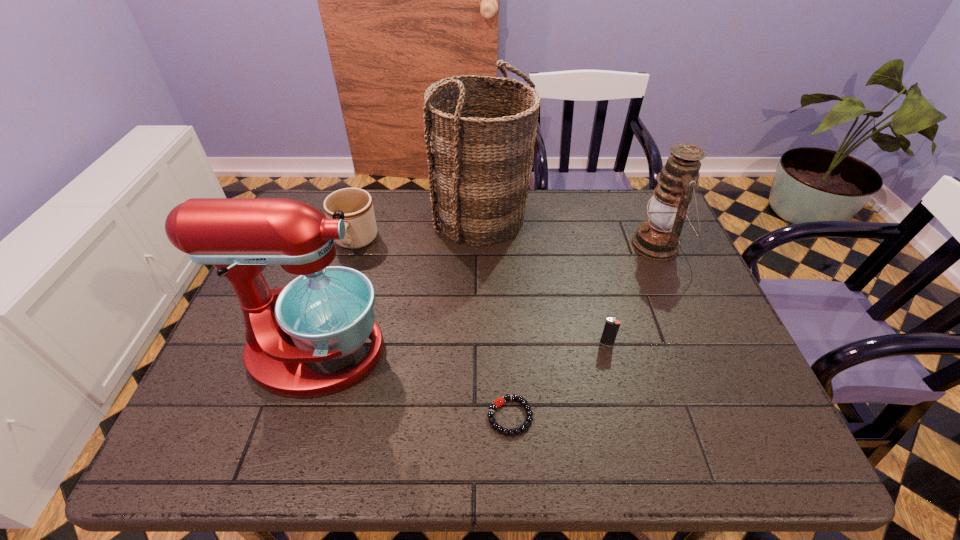
You are a GUI agent. You are given a task and a screenshot of the screen. Output one action in this format:
    pyautogui.click(x=<x>, y=<y>)
    Task: Click on the object that is positioned at the right edge
    The width and height of the screenshot is (960, 540).
    Given the screenshot: What is the action you would take?
    pyautogui.click(x=658, y=238)

You are a GUI agent. You are given a task and a screenshot of the screen. Output one action in this format:
    pyautogui.click(x=<x>, y=<y>)
    Task: Click on the object that is positioned at the far left corner
    
    Given the screenshot: What is the action you would take?
    pyautogui.click(x=360, y=224)

At what (x,y) coordinates should I click in order to perform the action: click on object positioned at the far right corner. Please return your answer as a coordinate pair (x, y). Looking at the image, I should click on (658, 238).

At what (x,y) coordinates should I click in order to perform the action: click on vacant space at the far edge of the desktop. Please return your answer as a coordinate pair (x, y). This screenshot has width=960, height=540. Looking at the image, I should click on (564, 195).

At what (x,y) coordinates should I click in order to perform the action: click on free space at the near edge. Please return your answer as a coordinate pair (x, y). Looking at the image, I should click on (355, 449).

At what (x,y) coordinates should I click in order to perform the action: click on vacant space at the right edge. Please return your answer as a coordinate pair (x, y). The image size is (960, 540). Looking at the image, I should click on (655, 267).

Find the location of a particular element. The height and width of the screenshot is (540, 960). free region at the far right corner of the desktop is located at coordinates (631, 193).

This screenshot has width=960, height=540. Find the location of `vacant area at the near right corner`. vacant area at the near right corner is located at coordinates (716, 447).

Identify the location of vacant area that lies between the fifth object from left to right and the lantern. Image resolution: width=960 pixels, height=540 pixels. (632, 294).

Identify the location of free space between the shortest object and the fifth object from left to right. (558, 380).